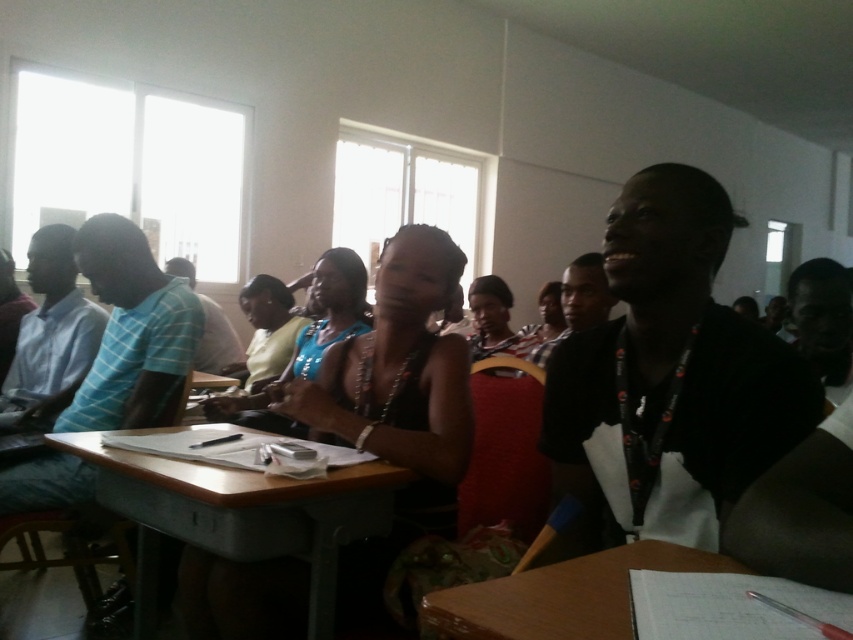
Question: Which is farther from the black beaded necklace at center?

Choices:
 (A) black fabric shirt at right
 (B) wooden desk at center

Answer: (A)

Question: Which point appears closest to the camera in this image?

Choices:
 (A) (291, 515)
 (B) (436, 596)

Answer: (B)

Question: Does black fabric shirt at right appear on the left side of black matte tank top at center?

Choices:
 (A) no
 (B) yes

Answer: (A)

Question: Does black fabric shirt at right have a larger size compared to black matte tank top at center?

Choices:
 (A) no
 (B) yes

Answer: (A)

Question: Can you confirm if black matte tank top at center is positioned to the left of matte black shirt at center?

Choices:
 (A) no
 (B) yes

Answer: (B)

Question: Based on their relative distances, which object is nearer to the wooden desk at center?

Choices:
 (A) wooden table at lower right
 (B) matte black tank top at center
 (C) black beaded necklace at center
 (D) black fabric shirt at right

Answer: (D)